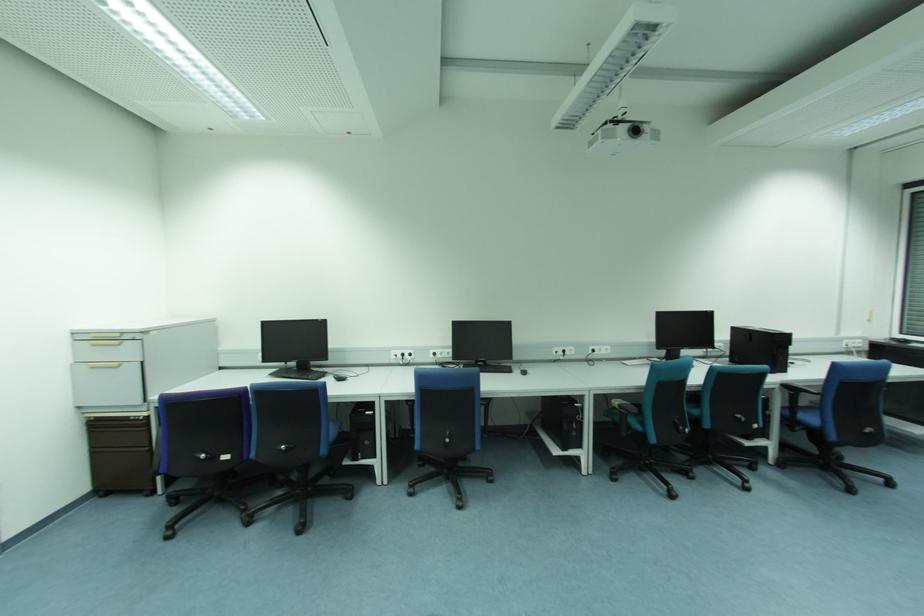
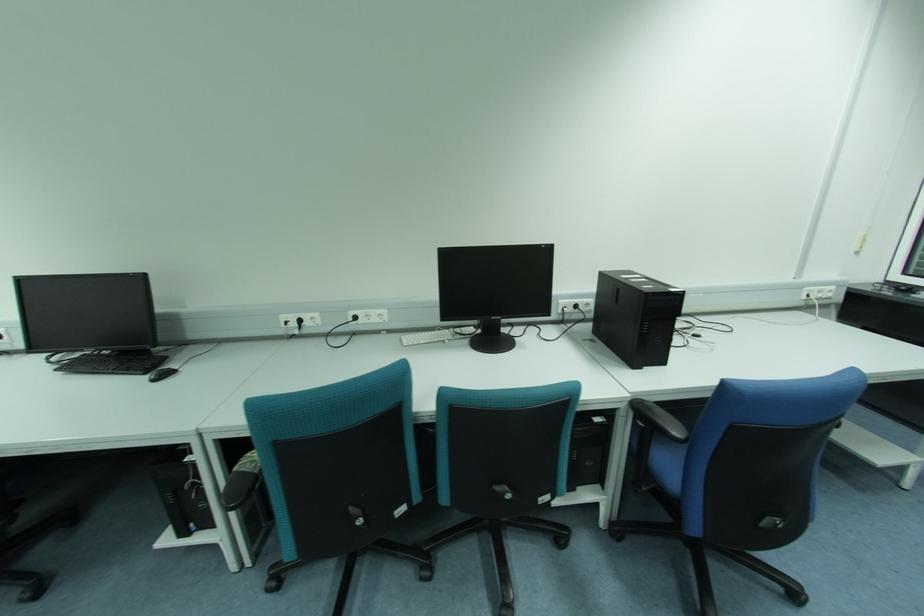
The point at (574, 353) is marked in the first image. Where is the corresponding point in the second image?

(319, 322)